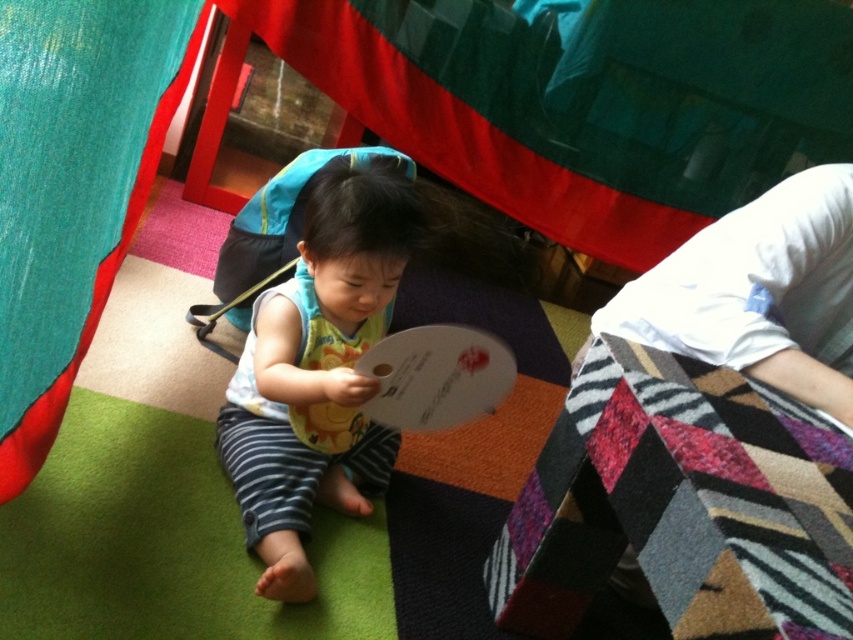
Question: Does multicolored woven quilt at lower right come in front of matte white bib at center?

Choices:
 (A) no
 (B) yes

Answer: (B)

Question: Is multicolored woven quilt at lower right smaller than matte white bib at center?

Choices:
 (A) yes
 (B) no

Answer: (B)

Question: Which of the following is the closest to the observer?

Choices:
 (A) coord(357,355)
 (B) coord(584,438)

Answer: (B)

Question: Is multicolored woven quilt at lower right below matte white bib at center?

Choices:
 (A) yes
 (B) no

Answer: (A)